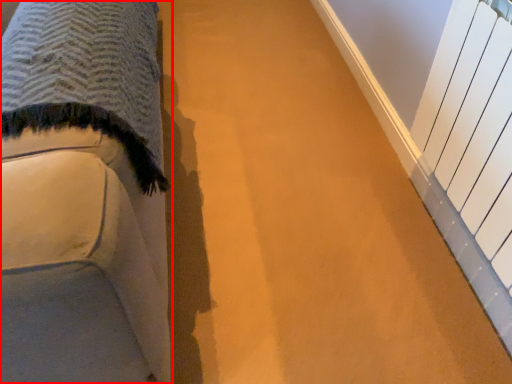
Question: From the image's perspective, considering the relative positions of furniture (annotated by the red box) and radiator in the image provided, where is furniture (annotated by the red box) located with respect to the staircase?

Choices:
 (A) below
 (B) above

Answer: (B)